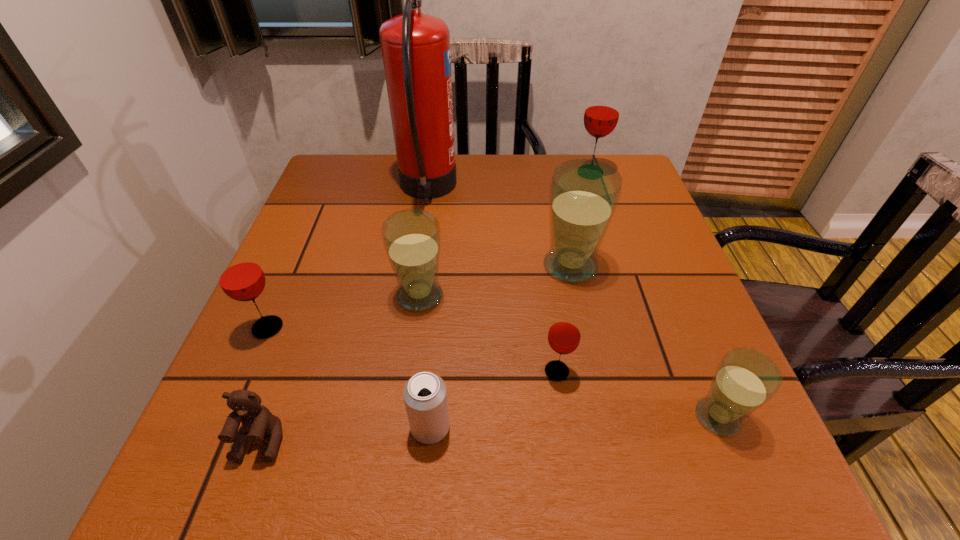
The height and width of the screenshot is (540, 960). What are the coordinates of `object located at the near left corner` in the screenshot? It's located at (257, 421).

Locate an element on the screen. Image resolution: width=960 pixels, height=540 pixels. object that is at the far right corner is located at coordinates (602, 111).

Where is `object at the near right corner`? object at the near right corner is located at coordinates (745, 379).

In the image, there is a desktop. Identify the location of vacant space at the far edge. Image resolution: width=960 pixels, height=540 pixels. (469, 190).

The image size is (960, 540). I want to click on vacant space at the near edge, so click(x=345, y=473).

In the image, there is a desktop. Where is `free region at the left edge`? This screenshot has width=960, height=540. free region at the left edge is located at coordinates point(338,232).

In order to click on blank space at the right edge of the desktop in this screenshot , I will do `click(673, 275)`.

The width and height of the screenshot is (960, 540). In the image, there is a desktop. Identify the location of vacant area at the far left corner. (380, 164).

Where is `free space at the far right corner of the desktop`? free space at the far right corner of the desktop is located at coordinates (581, 154).

At what (x,y) coordinates should I click in order to perform the action: click on vacant space in between the farthest red glass and the fire extinguisher. Please return your answer as a coordinate pair (x, y). Looking at the image, I should click on (509, 182).